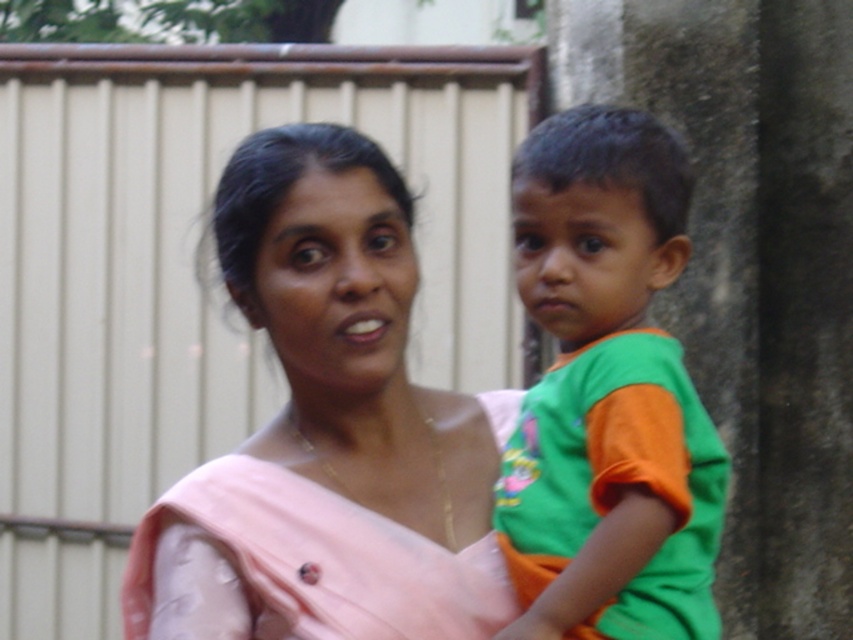
You are an observer looking at the scene. You notice the pink fabric at center and the green cotton shirt at center. Which object takes up more space in the image?

The pink fabric at center is bigger than the green cotton shirt at center, so it takes up more space in the image.